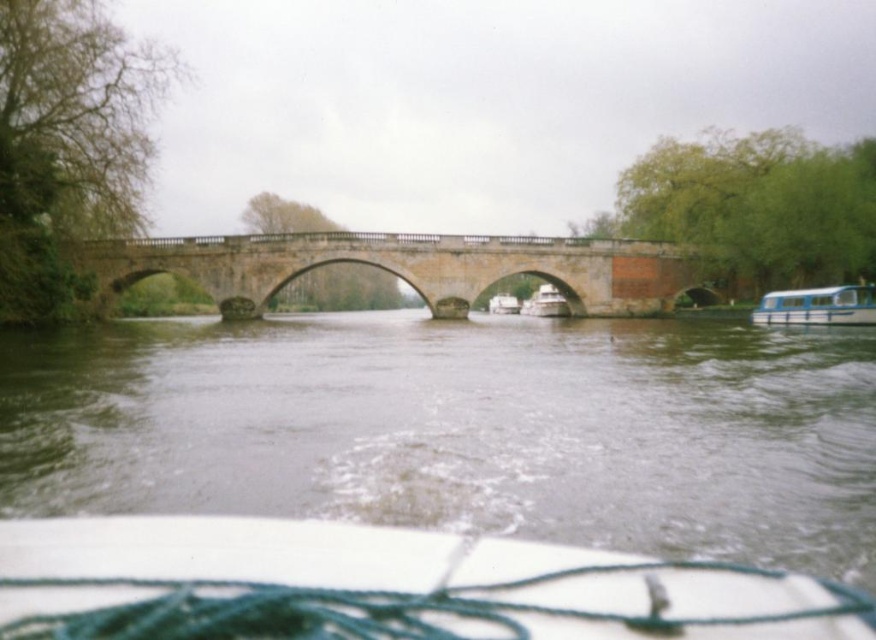
Question: Estimate the real-world distances between objects in this image. Which object is farther from the white glossy boat at right?

Choices:
 (A) white matte boat at center
 (B) stone bridge at center
 (C) greenish water at center

Answer: (A)

Question: Which point is closer to the camera?

Choices:
 (A) white plastic boat at center
 (B) white glossy boat at center

Answer: (B)

Question: Is greenish water at center thinner than white glossy boat at right?

Choices:
 (A) yes
 (B) no

Answer: (B)

Question: Which object appears farthest from the camera in this image?

Choices:
 (A) greenish water at center
 (B) stone bridge at center
 (C) white plastic boat at center
 (D) white matte boat at center

Answer: (C)

Question: Does stone bridge at center have a smaller size compared to white plastic boat at center?

Choices:
 (A) yes
 (B) no

Answer: (B)

Question: Considering the relative positions of stone bridge at center and white glossy boat at right in the image provided, where is stone bridge at center located with respect to white glossy boat at right?

Choices:
 (A) left
 (B) right

Answer: (A)